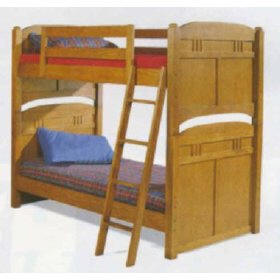
This screenshot has width=280, height=280. What are the coordinates of `upper foot board` in the screenshot? It's located at (222, 46).